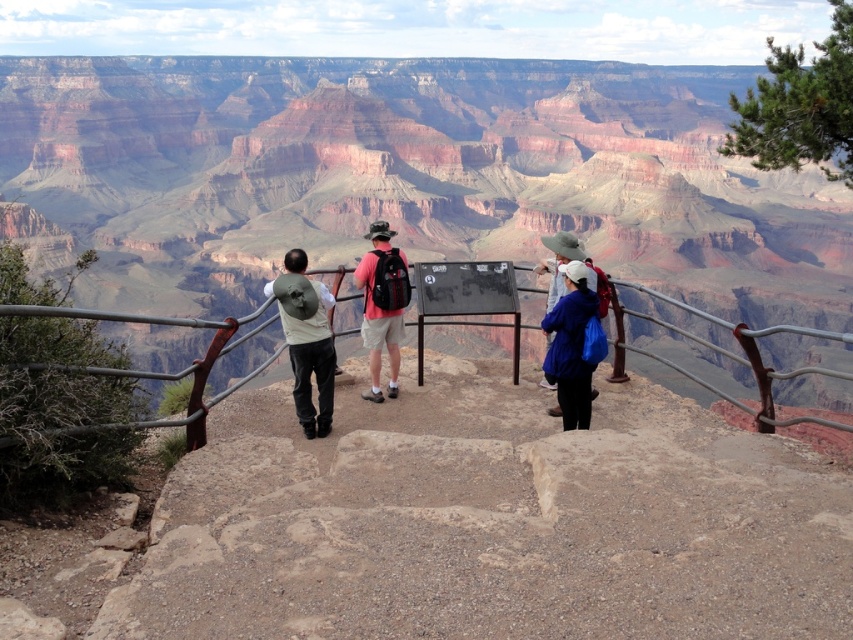
Question: Estimate the real-world distances between objects in this image. Which object is closer to the matte pink shirt at center?

Choices:
 (A) matte green backpack at center
 (B) rustic rock canyon at center
 (C) blue fabric jacket at center

Answer: (A)

Question: Is matte green backpack at center smaller than matte pink shirt at center?

Choices:
 (A) yes
 (B) no

Answer: (A)

Question: Estimate the real-world distances between objects in this image. Which object is closer to the matte green backpack at center?

Choices:
 (A) metallic gray railing at center
 (B) rustic rock canyon at center

Answer: (A)

Question: Is rustic rock canyon at center above matte green backpack at center?

Choices:
 (A) yes
 (B) no

Answer: (A)

Question: Which object appears farthest from the camera in this image?

Choices:
 (A) blue fabric jacket at center
 (B) matte green backpack at center
 (C) matte pink shirt at center

Answer: (C)

Question: Observing the image, what is the correct spatial positioning of blue fabric jacket at center in reference to matte pink shirt at center?

Choices:
 (A) right
 (B) left

Answer: (A)